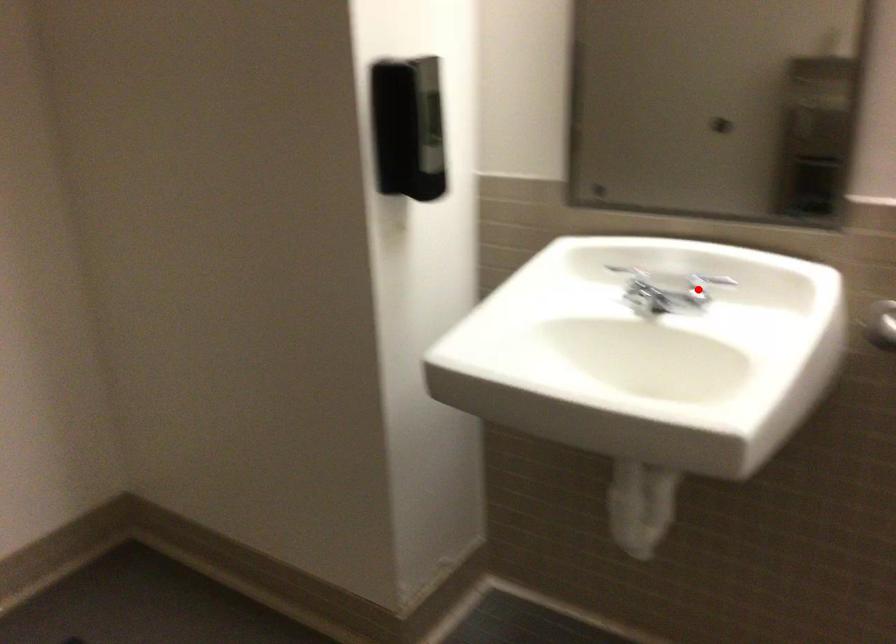
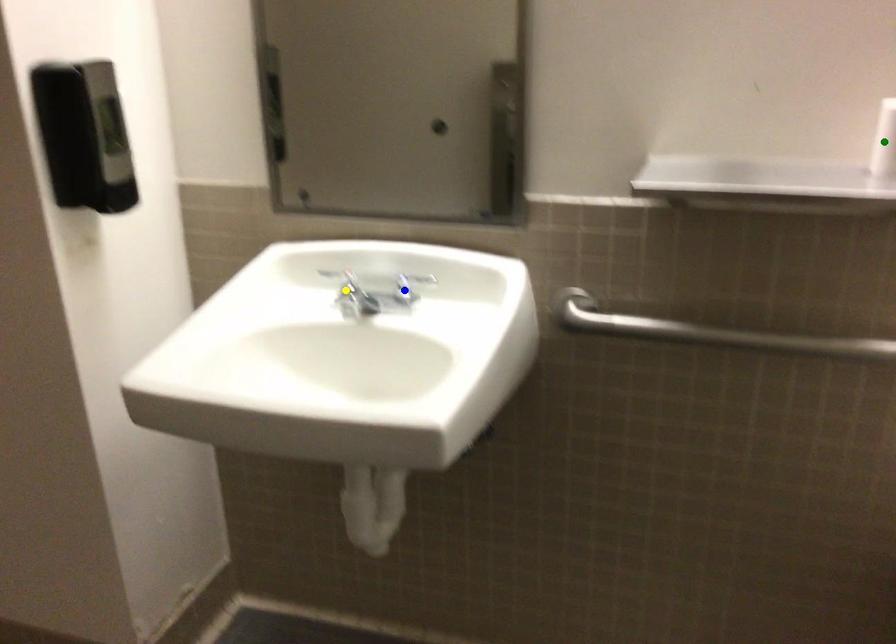
Question: I am providing you with two images of the same scene from different viewpoints. A red point is marked on the first image. You are given multiple points on the second image. Which point in image 2 is actually the same real-world point as the red point in image 1?

Choices:
 (A) green point
 (B) blue point
 (C) yellow point

Answer: (B)